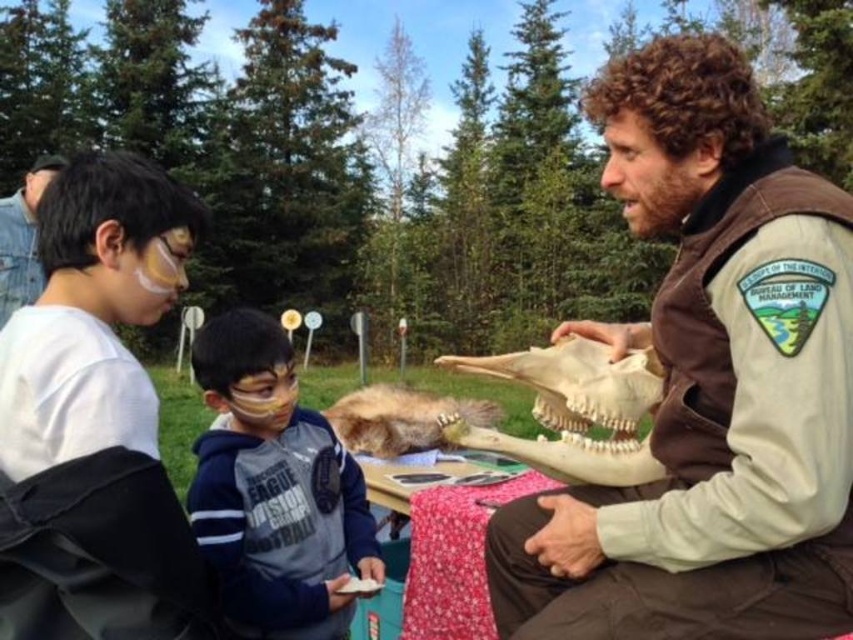
Based on the photo, does brown suede vest at center come behind denim jacket at upper left?

No, it is in front of denim jacket at upper left.

Consider the image. Does brown suede vest at center have a smaller size compared to denim jacket at upper left?

No, brown suede vest at center is not smaller than denim jacket at upper left.

This screenshot has width=853, height=640. Find the location of `brown suede vest at center`. brown suede vest at center is located at coordinates (706, 384).

At what (x,y) coordinates should I click in order to perform the action: click on brown suede vest at center. Please return your answer as a coordinate pair (x, y). This screenshot has height=640, width=853. Looking at the image, I should click on coord(706,384).

Between point (712, 168) and point (273, 353), which one is positioned behind?

The point (273, 353) is more distant.

Who is taller, brown suede vest at center or gray fleece sweatshirt at center?

Standing taller between the two is brown suede vest at center.

Describe the element at coordinates (706, 384) in the screenshot. The height and width of the screenshot is (640, 853). I see `brown suede vest at center` at that location.

Identify the location of brown suede vest at center. (706, 384).

Can you confirm if gray fleece sweatshirt at center is bigger than denim jacket at upper left?

Indeed, gray fleece sweatshirt at center has a larger size compared to denim jacket at upper left.

Can you confirm if gray fleece sweatshirt at center is taller than denim jacket at upper left?

Yes.

The width and height of the screenshot is (853, 640). In order to click on gray fleece sweatshirt at center in this screenshot , I will do `click(273, 490)`.

Find the location of a particular element. The image size is (853, 640). gray fleece sweatshirt at center is located at coordinates (273, 490).